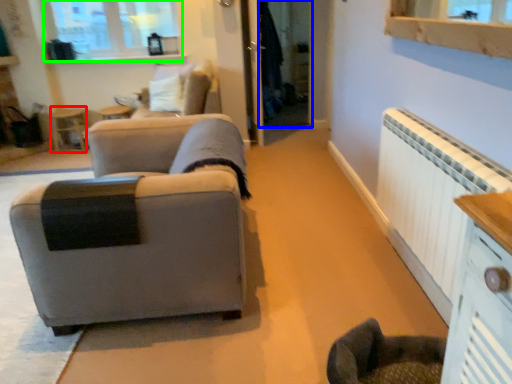
Question: Considering the real-world distances, which object is closest to side table (highlighted by a red box)? glass door (highlighted by a blue box) or window (highlighted by a green box).

Choices:
 (A) glass door
 (B) window

Answer: (B)